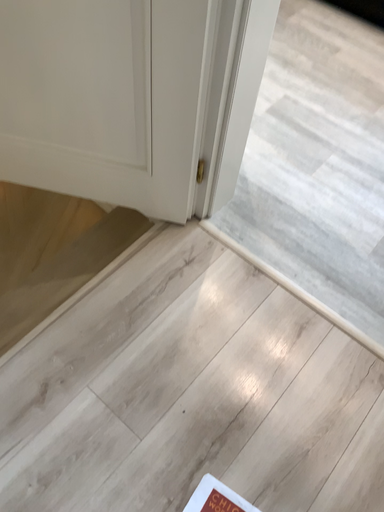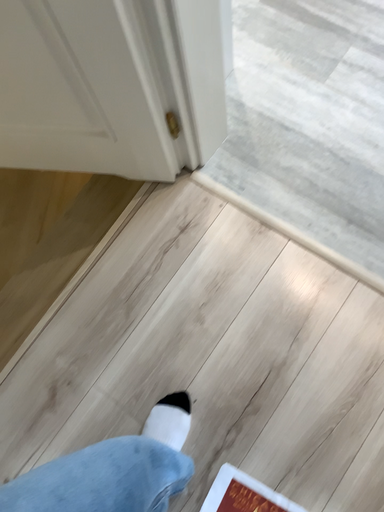
Question: How did the camera likely rotate when shooting the video?

Choices:
 (A) rotated downward
 (B) rotated upward

Answer: (A)